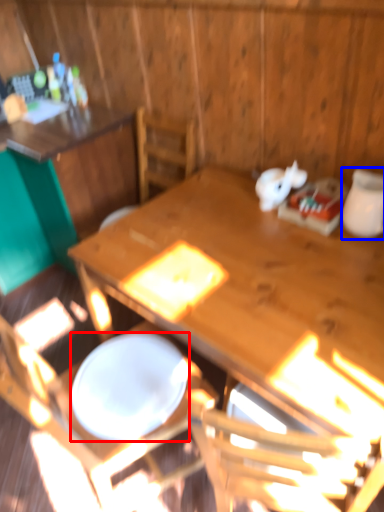
Question: Which object is further to the camera taking this photo, plate (highlighted by a red box) or tableware (highlighted by a blue box)?

Choices:
 (A) plate
 (B) tableware

Answer: (B)